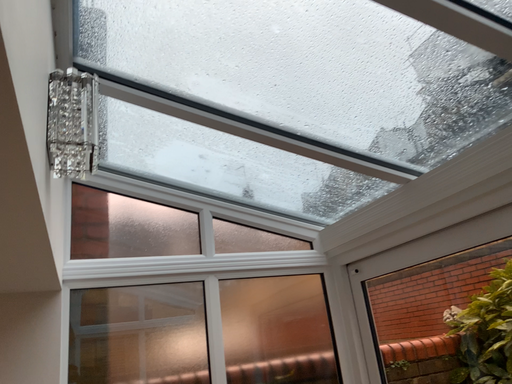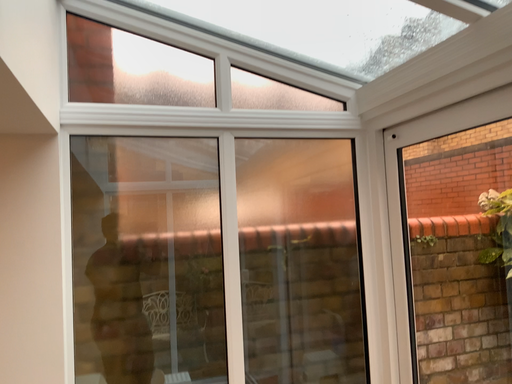
Question: How did the camera likely rotate when shooting the video?

Choices:
 (A) rotated upward
 (B) rotated downward

Answer: (B)